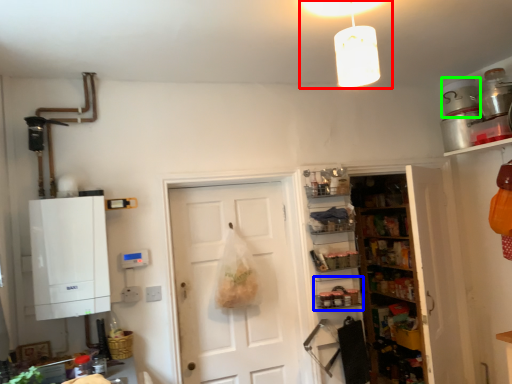
Question: Based on their relative distances, which object is farther from light fixture (highlighted by a red box)? Choose from shelf (highlighted by a blue box) and appliance (highlighted by a green box).

Choices:
 (A) shelf
 (B) appliance

Answer: (A)